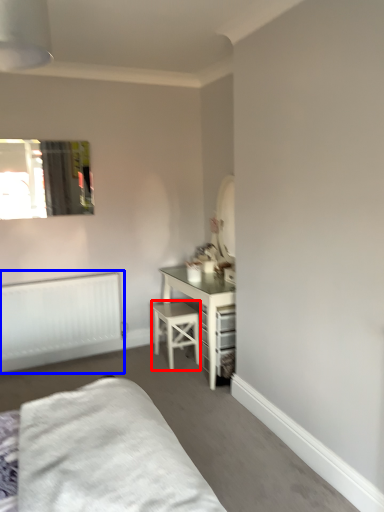
Question: Which point is closer to the camera, stool (highlighted by a red box) or radiator (highlighted by a blue box)?

Choices:
 (A) stool
 (B) radiator

Answer: (B)